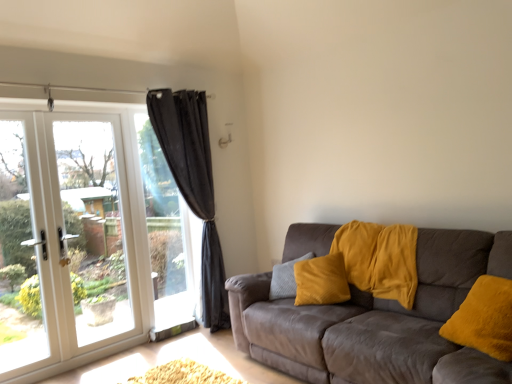
Question: Can you confirm if black curtain at left is wider than velvet brown couch at right?

Choices:
 (A) no
 (B) yes

Answer: (A)

Question: From a real-world perspective, is black curtain at left on top of velvet brown couch at right?

Choices:
 (A) yes
 (B) no

Answer: (A)

Question: Does black curtain at left lie behind velvet brown couch at right?

Choices:
 (A) no
 (B) yes

Answer: (B)

Question: Is black curtain at left in contact with velvet brown couch at right?

Choices:
 (A) no
 (B) yes

Answer: (A)

Question: Is black curtain at left taller than velvet brown couch at right?

Choices:
 (A) no
 (B) yes

Answer: (B)

Question: Does black curtain at left have a smaller size compared to velvet brown couch at right?

Choices:
 (A) yes
 (B) no

Answer: (A)

Question: Is the position of white glass door at left less distant than that of black curtain at left?

Choices:
 (A) yes
 (B) no

Answer: (A)

Question: Is white glass door at left positioned with its back to black curtain at left?

Choices:
 (A) no
 (B) yes

Answer: (B)

Question: Considering the relative sizes of white glass door at left and black curtain at left in the image provided, is white glass door at left wider than black curtain at left?

Choices:
 (A) yes
 (B) no

Answer: (A)

Question: Can you confirm if white glass door at left is thinner than black curtain at left?

Choices:
 (A) yes
 (B) no

Answer: (B)

Question: Can we say white glass door at left lies outside black curtain at left?

Choices:
 (A) no
 (B) yes

Answer: (B)

Question: From a real-world perspective, is white glass door at left physically above black curtain at left?

Choices:
 (A) no
 (B) yes

Answer: (A)

Question: Is velvet brown couch at right positioned with its back to black curtain at left?

Choices:
 (A) no
 (B) yes

Answer: (A)